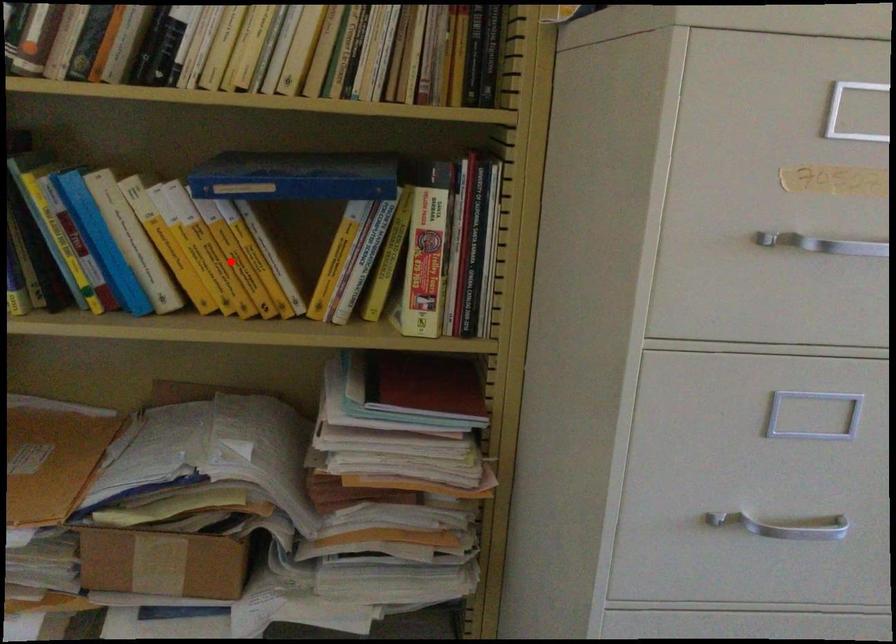
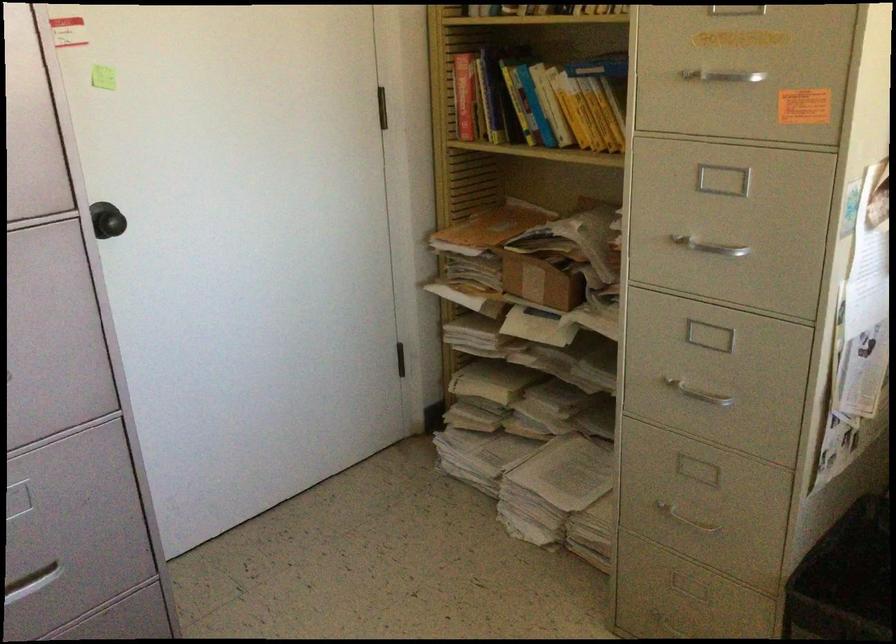
In the second image, find the point that corresponds to the highlighted location in the first image.

(590, 114)